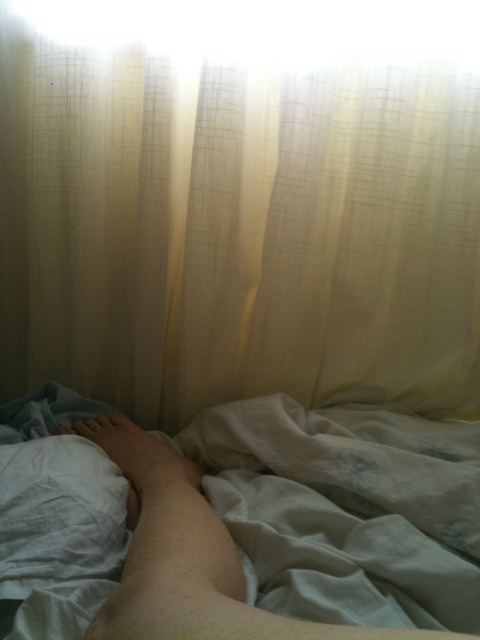
Does white sheer curtain at upper center have a smaller size compared to skinny white leg at lower left?

No.

Between white sheer curtain at upper center and skinny white leg at lower left, which one has more height?

white sheer curtain at upper center is taller.

In order to click on white sheer curtain at upper center in this screenshot , I will do `click(240, 204)`.

Where is `white sheer curtain at upper center`? white sheer curtain at upper center is located at coordinates (240, 204).